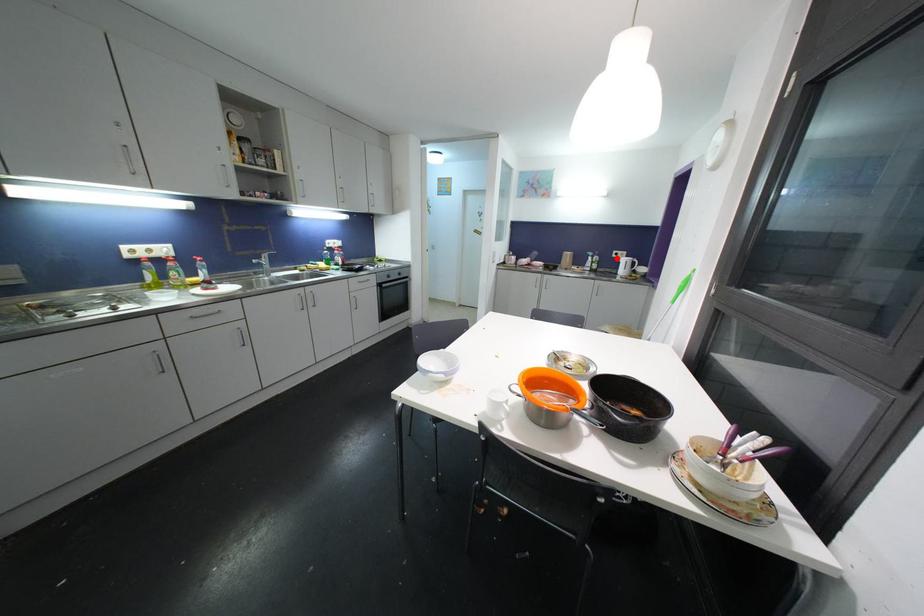
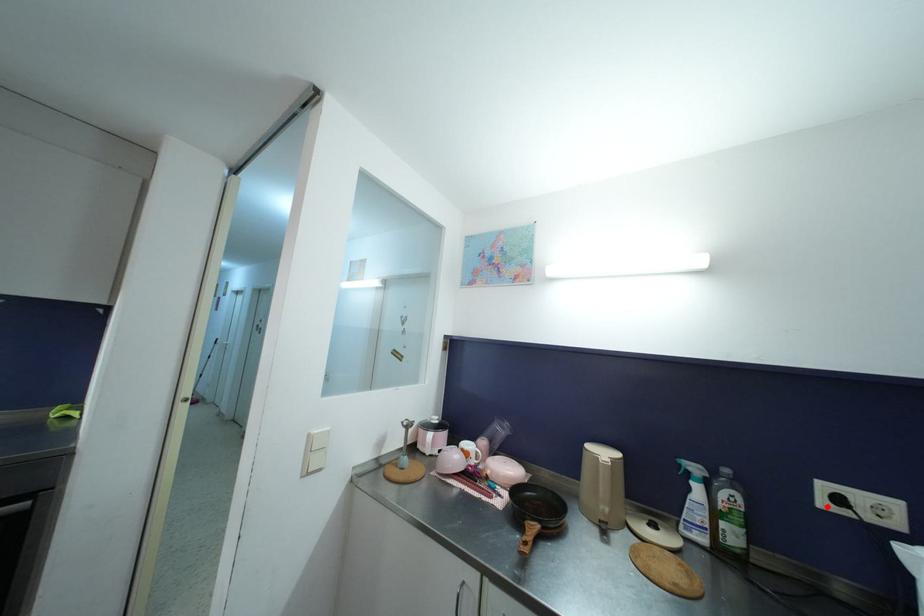
I am providing you with two images of the same scene from different viewpoints. A red point is marked on the first image and another point is marked on the second image. Do the highlighted points in image1 and image2 indicate the same real-world spot?

Yes